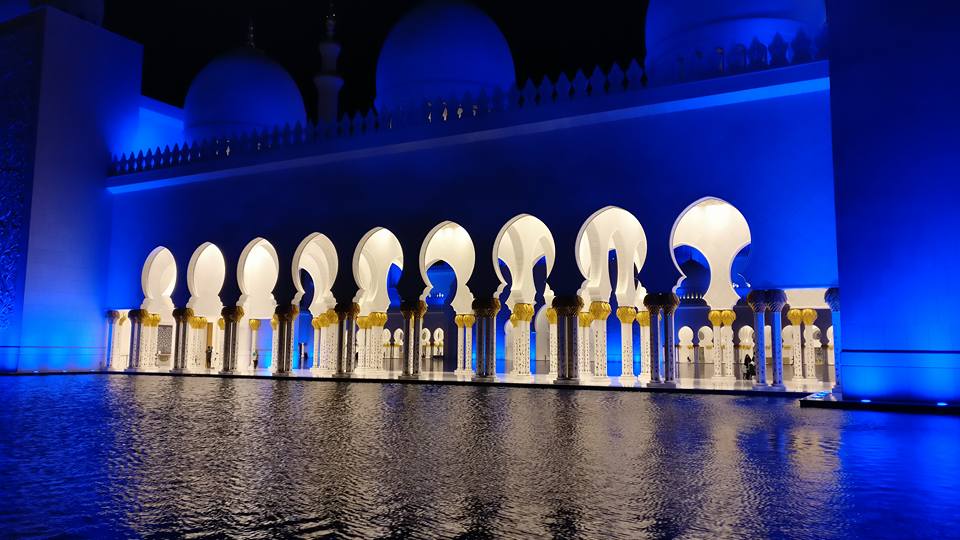
Where is `lights`? This screenshot has width=960, height=540. lights is located at coordinates (858, 401), (936, 405), (817, 397).